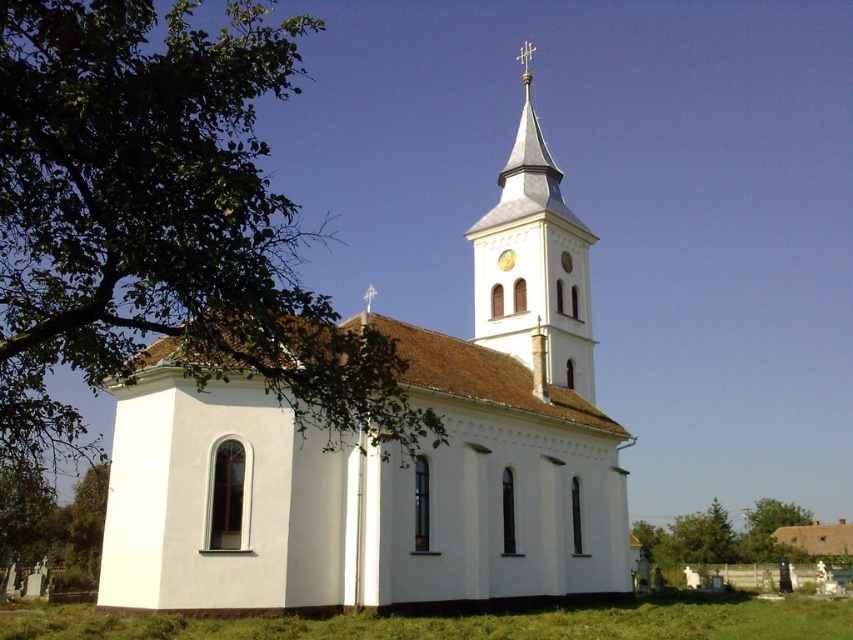
Can you confirm if green leafy tree at upper left is positioned below white stucco tower at upper center?

Correct, green leafy tree at upper left is located below white stucco tower at upper center.

Does point (202, 65) lie behind point (587, 384)?

No.

Who is more forward, (252, 323) or (544, 205)?

Point (252, 323) is more forward.

I want to click on green leafy tree at upper left, so click(x=161, y=225).

Who is lower down, green grass at lower center or white stucco tower at upper center?

green grass at lower center is below.

Describe the element at coordinates (462, 621) in the screenshot. I see `green grass at lower center` at that location.

Which is in front, point (616, 637) or point (537, 176)?

Point (616, 637)

I want to click on green grass at lower center, so point(462,621).

Between white smooth church at center and green leafy tree at upper left, which one appears on the right side from the viewer's perspective?

From the viewer's perspective, white smooth church at center appears more on the right side.

Is white smooth church at center above green leafy tree at upper left?

Indeed, white smooth church at center is positioned over green leafy tree at upper left.

Is point (566, 298) farther from camera compared to point (149, 294)?

Yes, point (566, 298) is behind point (149, 294).

Image resolution: width=853 pixels, height=640 pixels. Find the location of `white smooth church at center`. white smooth church at center is located at coordinates (392, 452).